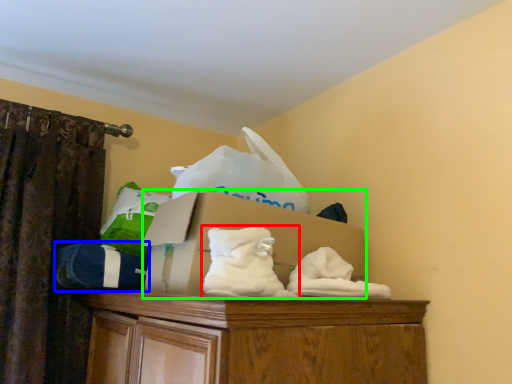
Question: Estimate the real-world distances between objects in this image. Which object is farther from sheet (highlighted by a red box), clothing (highlighted by a blue box) or cardboard box (highlighted by a green box)?

Choices:
 (A) clothing
 (B) cardboard box

Answer: (A)